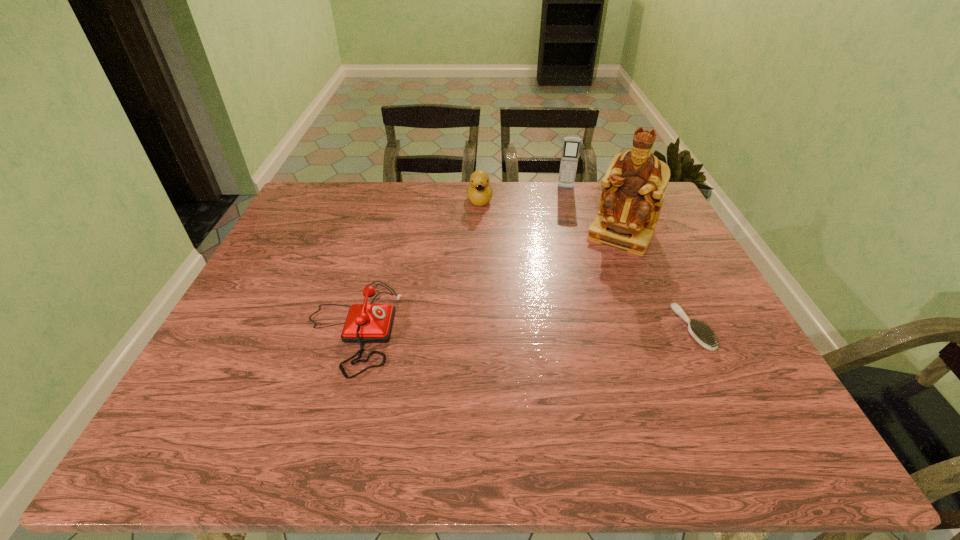
Find the location of `free region at the near left corner of the desktop`. free region at the near left corner of the desktop is located at coordinates (260, 396).

Image resolution: width=960 pixels, height=540 pixels. I want to click on vacant space that's between the fourth object from right to left and the leftmost object, so click(x=416, y=264).

Locate an element on the screen. This screenshot has width=960, height=540. vacant space that is in between the leftmost object and the third tallest object is located at coordinates (416, 264).

Image resolution: width=960 pixels, height=540 pixels. Find the location of `free area in between the second object from left to right and the leftmost object`. free area in between the second object from left to right and the leftmost object is located at coordinates (416, 264).

This screenshot has width=960, height=540. What are the coordinates of `vacant space that is in between the scrubbing brush and the telephone` in the screenshot? It's located at (522, 328).

Locate an element on the screen. free space between the tallest object and the cellular telephone is located at coordinates (593, 212).

The image size is (960, 540). Identify the location of vacant area between the cellular telephone and the scrubbing brush. (629, 258).

The image size is (960, 540). Find the location of `vacant space in between the shortest object and the tallest object`. vacant space in between the shortest object and the tallest object is located at coordinates (657, 281).

Find the location of a particular element. The height and width of the screenshot is (540, 960). vacant area that lies between the fourth shortest object and the telephone is located at coordinates (459, 258).

The height and width of the screenshot is (540, 960). Identify the location of blank region between the third nearest object and the shortest object. (657, 281).